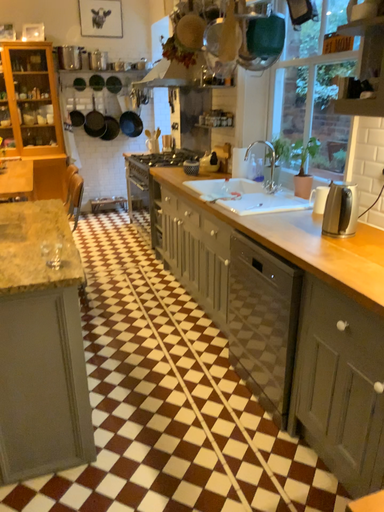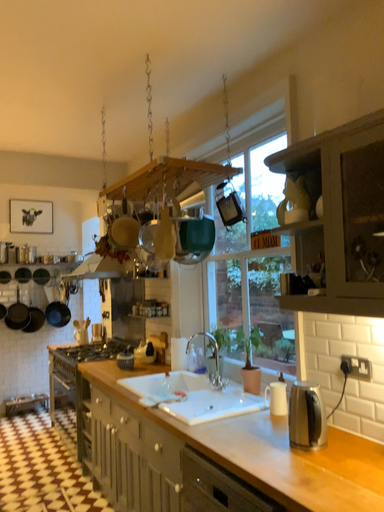
Question: Which way did the camera rotate in the video?

Choices:
 (A) rotated downward
 (B) rotated upward

Answer: (B)